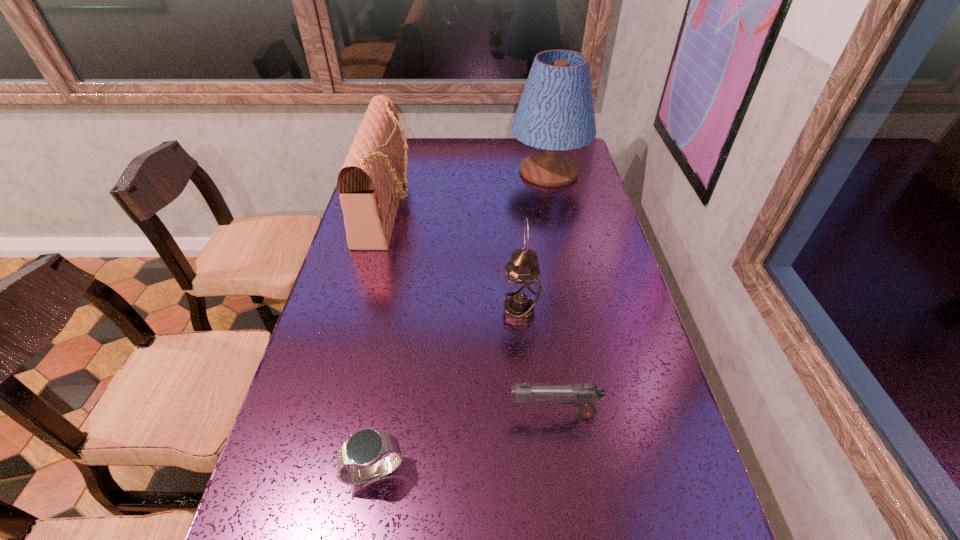
The image size is (960, 540). I want to click on free space between the second nearest object and the oil lamp, so [537, 363].

At what (x,y) coordinates should I click in order to perform the action: click on vacant region between the nearest object and the oil lamp. Please return your answer as a coordinate pair (x, y). This screenshot has height=540, width=960. Looking at the image, I should click on (447, 392).

Identify which object is the fourth closest to the tallest object. Please provide its 2D coordinates. Your answer should be formatted as a tuple, i.e. [(x, y)], where the tuple contains the x and y coordinates of a point satisfying the conditions above.

[(363, 450)]

Locate which object is the third closest to the tallest object. Please provide its 2D coordinates. Your answer should be formatted as a tuple, i.e. [(x, y)], where the tuple contains the x and y coordinates of a point satisfying the conditions above.

[(582, 395)]

At what (x,y) coordinates should I click in order to perform the action: click on vacant region that satisfies the following two spatial constraints: 1. on the front side of the lampshade; 2. in the direction the fourth farthest object is aimed. Please return your answer as a coordinate pair (x, y). Looking at the image, I should click on (600, 415).

Locate an element on the screen. This screenshot has width=960, height=540. free spot that satisfies the following two spatial constraints: 1. on the back side of the watch; 2. on the front-facing side of the handbag is located at coordinates click(x=420, y=207).

At what (x,y) coordinates should I click in order to perform the action: click on vacant space that satisfies the following two spatial constraints: 1. on the front-facing side of the handbag; 2. on the back side of the watch. Please return your answer as a coordinate pair (x, y). The image size is (960, 540). Looking at the image, I should click on (319, 471).

This screenshot has width=960, height=540. I want to click on free space in the image that satisfies the following two spatial constraints: 1. on the front-facing side of the third farthest object; 2. on the right side of the handbag, so 360,312.